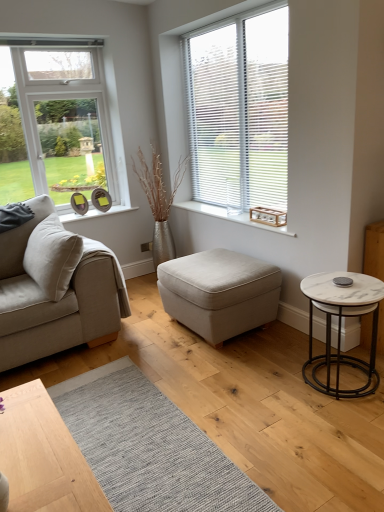
Question: Is the position of white marble side table at right less distant than that of white blinds at upper right?

Choices:
 (A) yes
 (B) no

Answer: (A)

Question: Is white marble side table at right to the left of white blinds at upper right from the viewer's perspective?

Choices:
 (A) yes
 (B) no

Answer: (B)

Question: Can you confirm if white marble side table at right is thinner than white blinds at upper right?

Choices:
 (A) no
 (B) yes

Answer: (A)

Question: From the image's perspective, would you say white marble side table at right is positioned over white blinds at upper right?

Choices:
 (A) yes
 (B) no

Answer: (B)

Question: From a real-world perspective, is white marble side table at right located higher than white blinds at upper right?

Choices:
 (A) yes
 (B) no

Answer: (B)

Question: Which is correct: white marble side table at right is inside beige fabric couch at left, or outside of it?

Choices:
 (A) inside
 (B) outside

Answer: (B)

Question: Looking at the image, does white marble side table at right seem bigger or smaller compared to beige fabric couch at left?

Choices:
 (A) small
 (B) big

Answer: (A)

Question: Relative to beige fabric couch at left, is white marble side table at right in front or behind?

Choices:
 (A) front
 (B) behind

Answer: (A)

Question: Considering the positions of white marble side table at right and beige fabric couch at left in the image, is white marble side table at right taller or shorter than beige fabric couch at left?

Choices:
 (A) tall
 (B) short

Answer: (B)

Question: From a real-world perspective, is white marble side table at right above or below wooden crate at center?

Choices:
 (A) below
 (B) above

Answer: (A)

Question: Looking at their shapes, would you say white marble side table at right is wider or thinner than wooden crate at center?

Choices:
 (A) thin
 (B) wide

Answer: (B)

Question: Based on their sizes in the image, would you say white marble side table at right is bigger or smaller than wooden crate at center?

Choices:
 (A) big
 (B) small

Answer: (A)

Question: Is white marble side table at right taller or shorter than wooden crate at center?

Choices:
 (A) tall
 (B) short

Answer: (A)

Question: In terms of height, does white blinds at upper right look taller or shorter compared to light beige fabric ottoman at center?

Choices:
 (A) tall
 (B) short

Answer: (A)

Question: Is white blinds at upper right inside or outside of light beige fabric ottoman at center?

Choices:
 (A) outside
 (B) inside

Answer: (A)